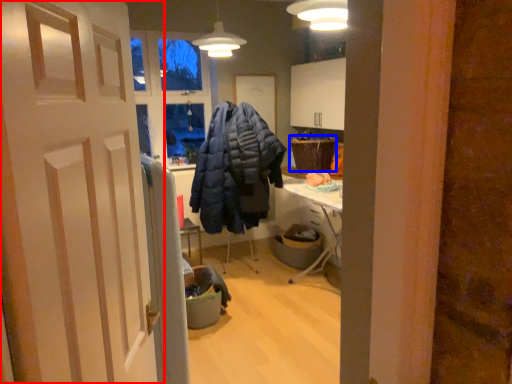
Question: Which point is closer to the camera, door (highlighted by a red box) or picnic basket (highlighted by a blue box)?

Choices:
 (A) door
 (B) picnic basket

Answer: (A)